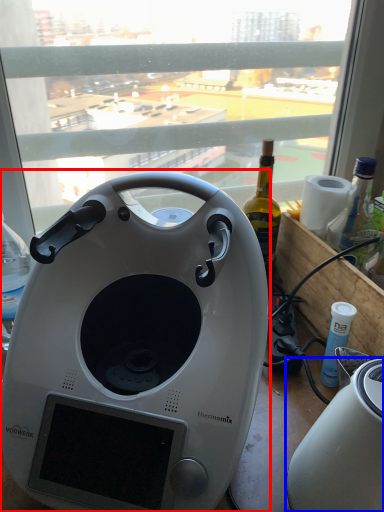
Question: Which object appears closest to the camera in this image, home appliance (highlighted by a red box) or toaster (highlighted by a blue box)?

Choices:
 (A) home appliance
 (B) toaster

Answer: (B)